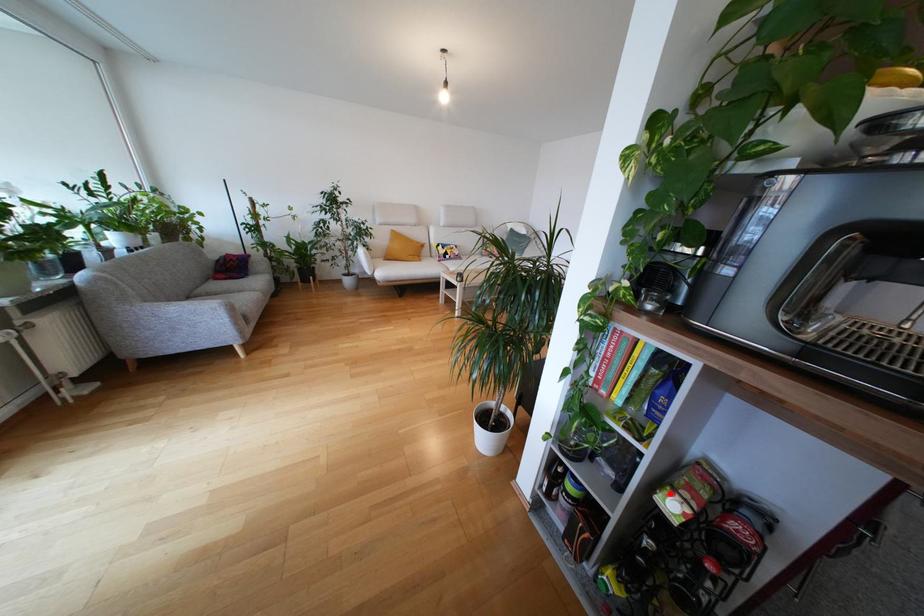
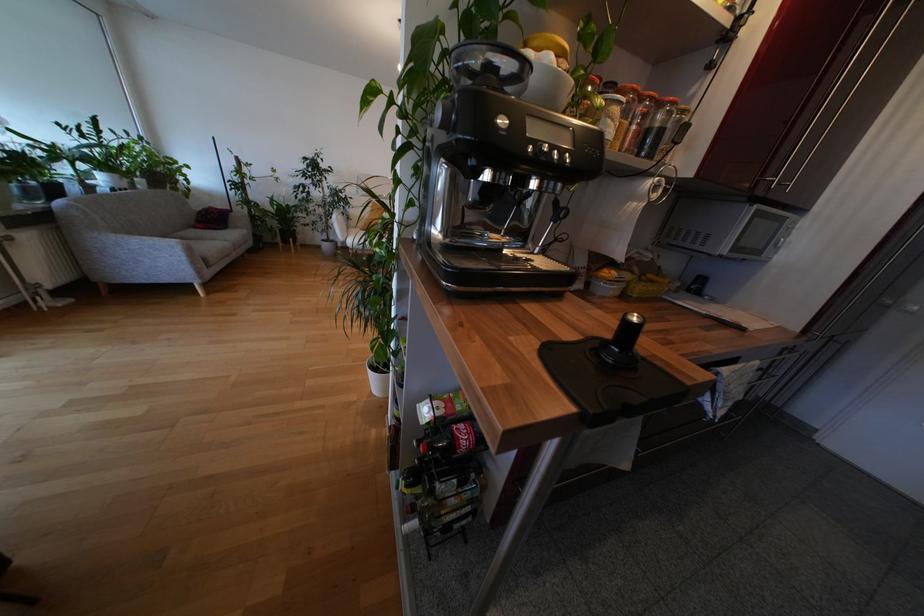
Locate, in the second image, the point that corresponds to the highlighted location in the first image.

(431, 402)